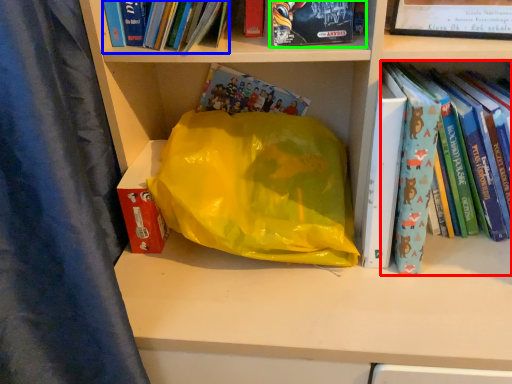
Question: Based on their relative distances, which object is farther from book (highlighted by a red box)? Choose from book (highlighted by a blue box) and book (highlighted by a green box).

Choices:
 (A) book
 (B) book

Answer: (A)